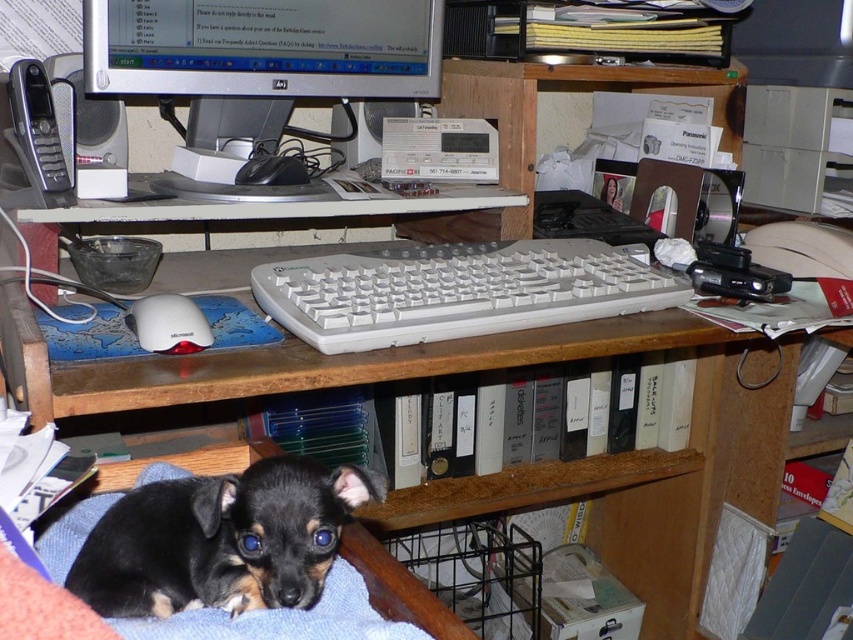
Question: Is matte black monitor at upper center wider than white plastic keyboard at center?

Choices:
 (A) no
 (B) yes

Answer: (A)

Question: Among these objects, which one is nearest to the camera?

Choices:
 (A) black fur dog at lower left
 (B) white plastic keyboard at center
 (C) matte black monitor at upper center

Answer: (A)

Question: In this image, where is matte black monitor at upper center located relative to white plastic keyboard at center?

Choices:
 (A) below
 (B) above

Answer: (B)

Question: Which object is closer to the camera taking this photo?

Choices:
 (A) black fur dog at lower left
 (B) white plastic keyboard at center

Answer: (A)

Question: Which of the following is the closest to the observer?

Choices:
 (A) (329, 509)
 (B) (369, 260)

Answer: (A)

Question: Is black fur dog at lower left wider than matte black monitor at upper center?

Choices:
 (A) yes
 (B) no

Answer: (B)